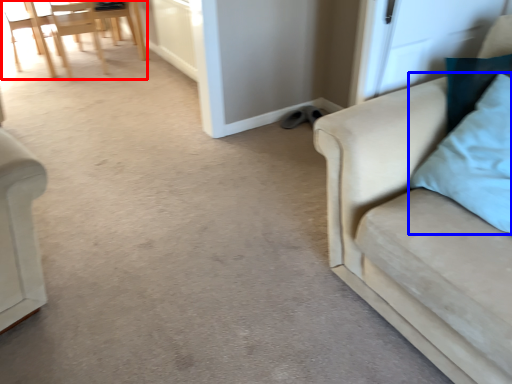
Question: Which of the following is the farthest to the observer, chair (highlighted by a red box) or pillow (highlighted by a blue box)?

Choices:
 (A) chair
 (B) pillow

Answer: (A)